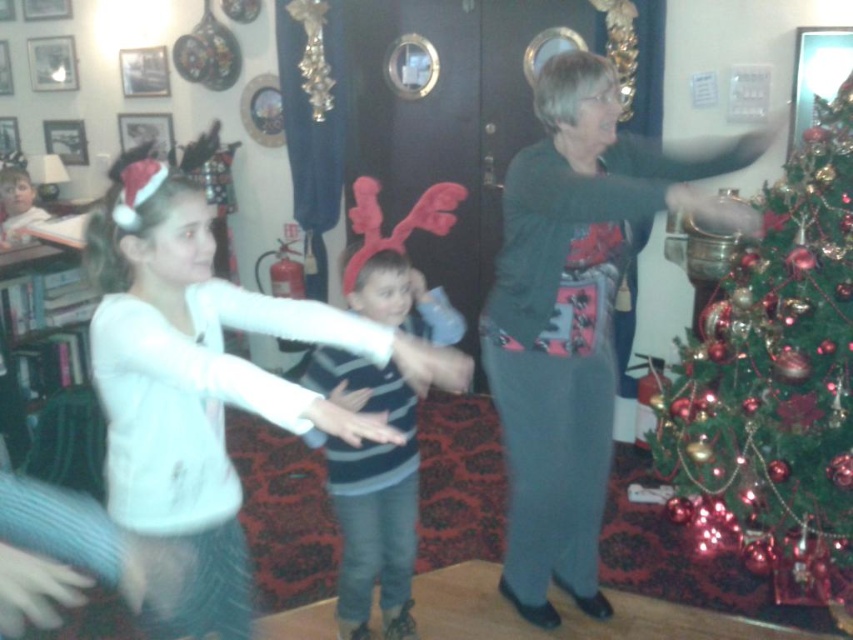
You are a photographer standing in the living room and want to take a photo of both the dark gray sweater at center and the white matte sweater at center. Which sweater should you focus on first to ensure both are in clear focus?

You should focus on the dark gray sweater at center first because it is closer to you than the white matte sweater at center, ensuring both will be in focus when focused on the closer one first.

You are a photographer trying to capture a group photo of the two children and the adult woman in the scene. The camera you are using has a focus range of 12 inches. Can you focus on both the white matte sweater at center and the striped knit sweater at center simultaneously?

The white matte sweater at center is 11.93 inches away from the striped knit sweater at center, so yes, both can be in focus since the distance between them is within the camera focus range of 12 inches.